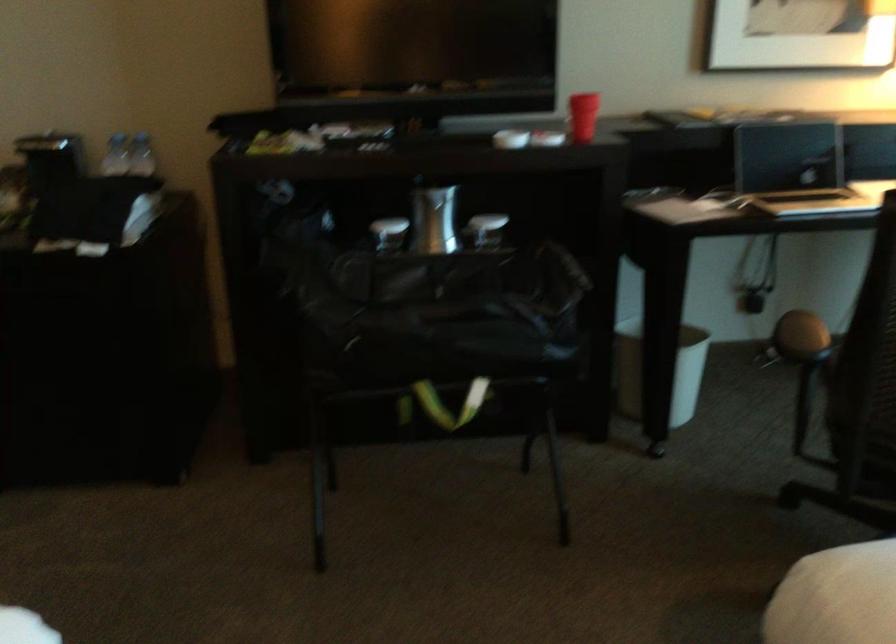
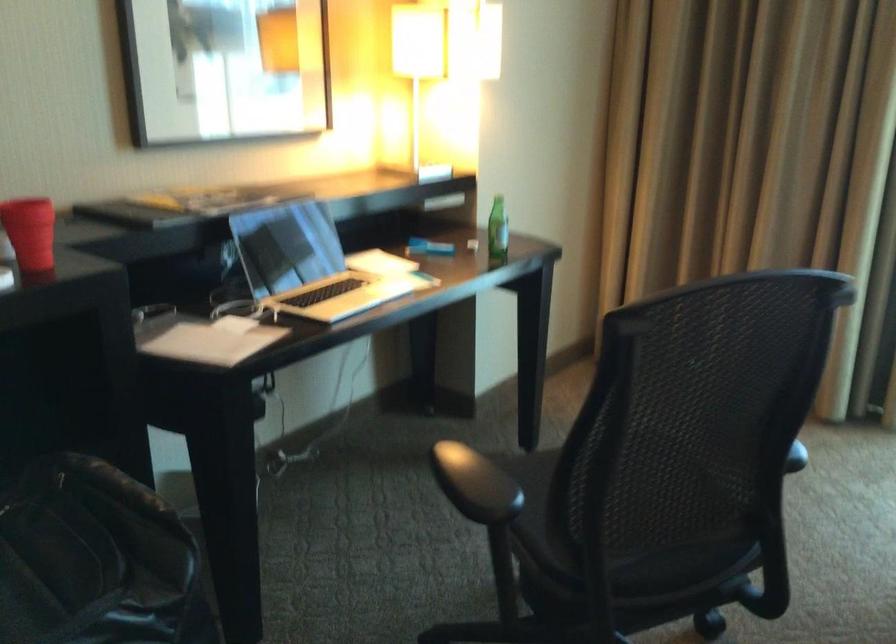
In the second image, find the point that corresponds to the point at 724,190 in the first image.

(237, 304)